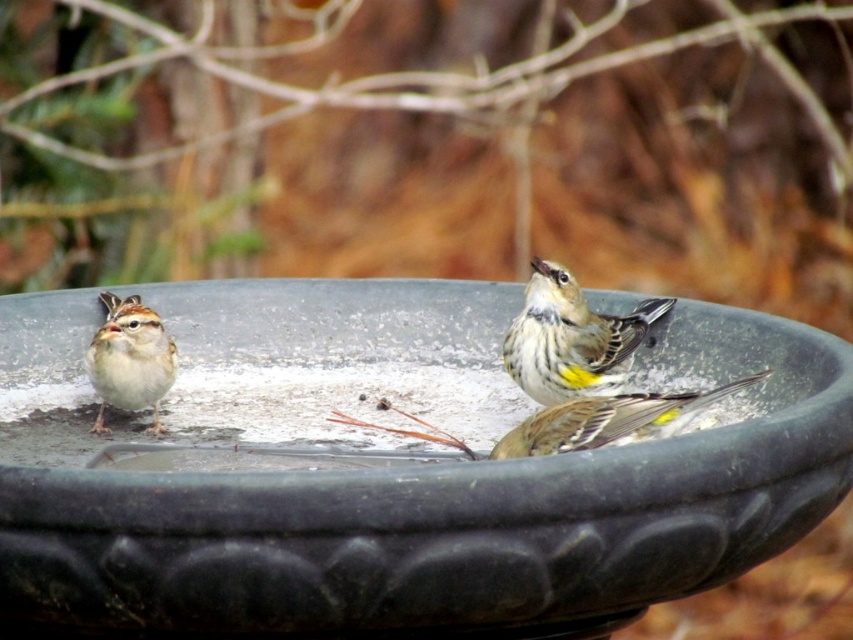
Question: Which object appears closest to the camera in this image?

Choices:
 (A) black matte bird bath at center
 (B) yellow-green textured bird at center
 (C) yellow-green speckled feathers at center
 (D) white fluffy sparrow at left

Answer: (A)

Question: Can you confirm if yellow-green textured bird at center is wider than white fluffy sparrow at left?

Choices:
 (A) yes
 (B) no

Answer: (A)

Question: Is black matte bird bath at center to the right of yellow-green speckled feathers at center from the viewer's perspective?

Choices:
 (A) yes
 (B) no

Answer: (B)

Question: Can you confirm if yellow-green textured bird at center is thinner than yellow-green speckled feathers at center?

Choices:
 (A) yes
 (B) no

Answer: (A)

Question: Which object appears farthest from the camera in this image?

Choices:
 (A) yellow-green speckled feathers at center
 (B) yellow-green textured bird at center

Answer: (B)

Question: Which of the following is the closest to the observer?

Choices:
 (A) (564, 588)
 (B) (573, 282)
 (C) (646, 413)
 (D) (149, 404)

Answer: (A)